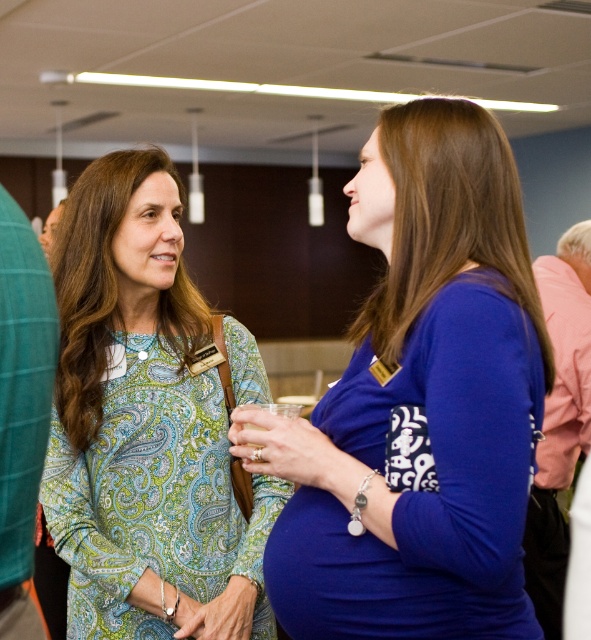
Question: Considering the relative positions of blue fabric dress at center and paisley-patterned blouse at center in the image provided, where is blue fabric dress at center located with respect to paisley-patterned blouse at center?

Choices:
 (A) above
 (B) below

Answer: (A)

Question: Can you confirm if blue fabric dress at center is positioned below paisley-patterned blouse at center?

Choices:
 (A) no
 (B) yes

Answer: (A)

Question: Among these objects, which one is nearest to the camera?

Choices:
 (A) paisley-patterned blouse at center
 (B) blue fabric dress at center

Answer: (B)

Question: Which object is farther from the camera taking this photo?

Choices:
 (A) blue fabric dress at center
 (B) paisley-patterned blouse at center

Answer: (B)

Question: Among these objects, which one is farthest from the camera?

Choices:
 (A) paisley-patterned blouse at center
 (B) blue fabric dress at center

Answer: (A)

Question: From the image, what is the correct spatial relationship of blue fabric dress at center in relation to paisley-patterned blouse at center?

Choices:
 (A) above
 (B) below

Answer: (A)